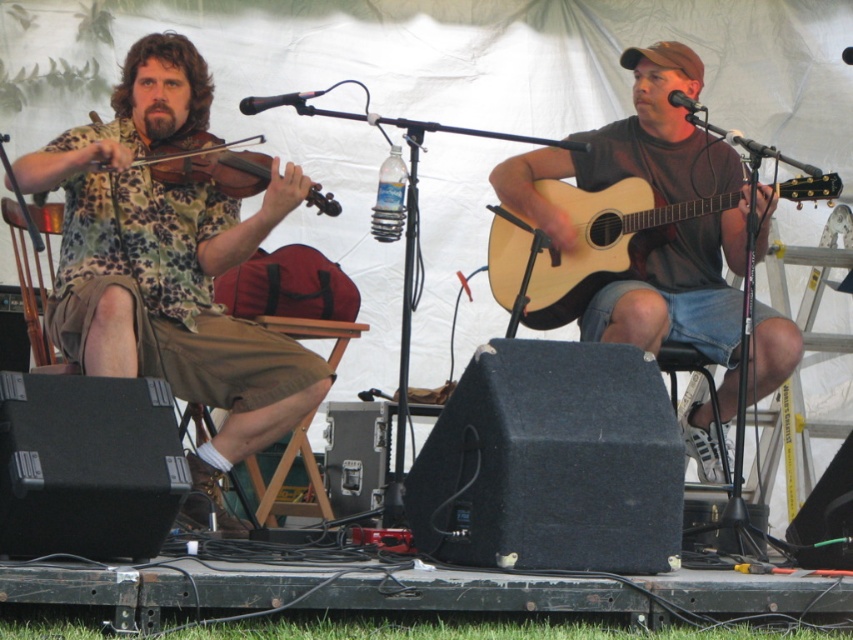
Question: Which of the following is the farthest from the observer?

Choices:
 (A) (610, 276)
 (B) (140, 38)
 (C) (664, 268)
 (D) (207, 176)

Answer: (C)

Question: Does camouflage shirt at left appear under natural wood acoustic guitar at right?

Choices:
 (A) yes
 (B) no

Answer: (A)

Question: Which object appears farthest from the camera in this image?

Choices:
 (A) camouflage shirt at left
 (B) matte black violin at left
 (C) natural wood acoustic guitar at right

Answer: (B)

Question: Considering the real-world distances, which object is farthest from the matte black violin at left?

Choices:
 (A) camouflage shirt at left
 (B) matte brown guitar at center

Answer: (B)

Question: Can you confirm if camouflage shirt at left is positioned below matte black violin at left?

Choices:
 (A) yes
 (B) no

Answer: (A)

Question: Can you confirm if natural wood acoustic guitar at right is smaller than matte black violin at left?

Choices:
 (A) no
 (B) yes

Answer: (A)